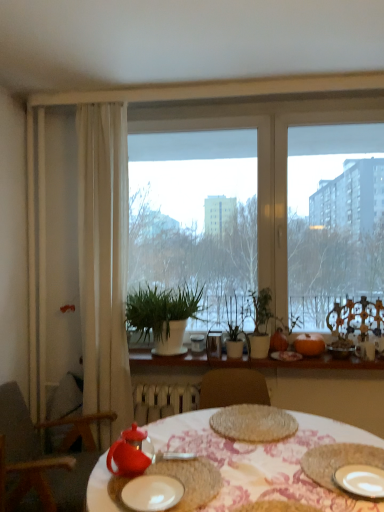
Locate an element on the screen. The height and width of the screenshot is (512, 384). free space that is in between white ceramic plate at lower right, the second plate positioned from the left, and matte red teapot at lower center, the first tableware viewed from the front is located at coordinates (245, 479).